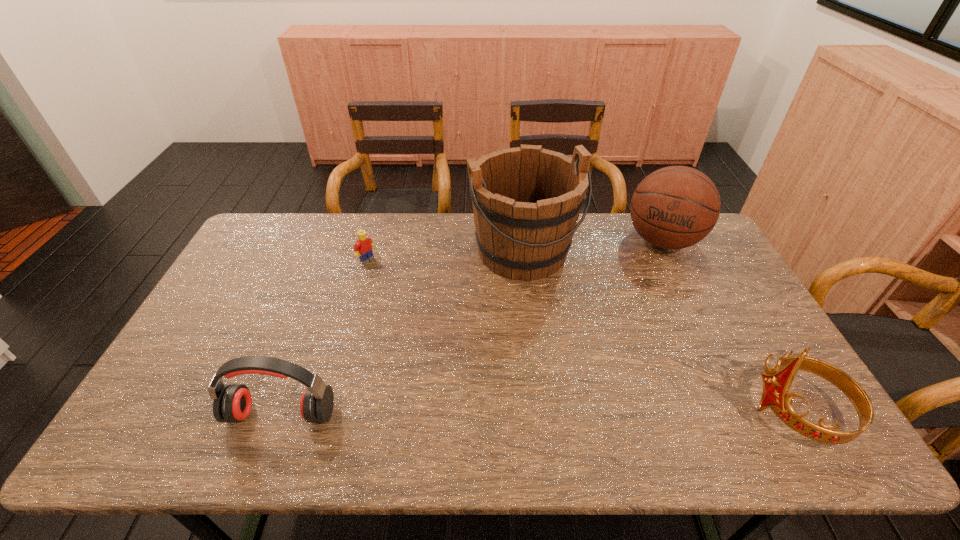
The width and height of the screenshot is (960, 540). Find the location of `object that is the second closest to the Lego`. object that is the second closest to the Lego is located at coordinates (232, 403).

What are the coordinates of `vacant space that satisfies the following two spatial constraints: 1. on the back side of the basketball; 2. on the right side of the third object from right to left` in the screenshot? It's located at click(522, 240).

The width and height of the screenshot is (960, 540). In order to click on free spot that satisfies the following two spatial constraints: 1. on the back side of the third object from left to right; 2. on the right side of the shortest object in this screenshot , I will do `click(370, 252)`.

Locate an element on the screen. This screenshot has height=540, width=960. vacant space that satisfies the following two spatial constraints: 1. on the front side of the tiara; 2. on the front-facing side of the tallest object is located at coordinates pos(541,411).